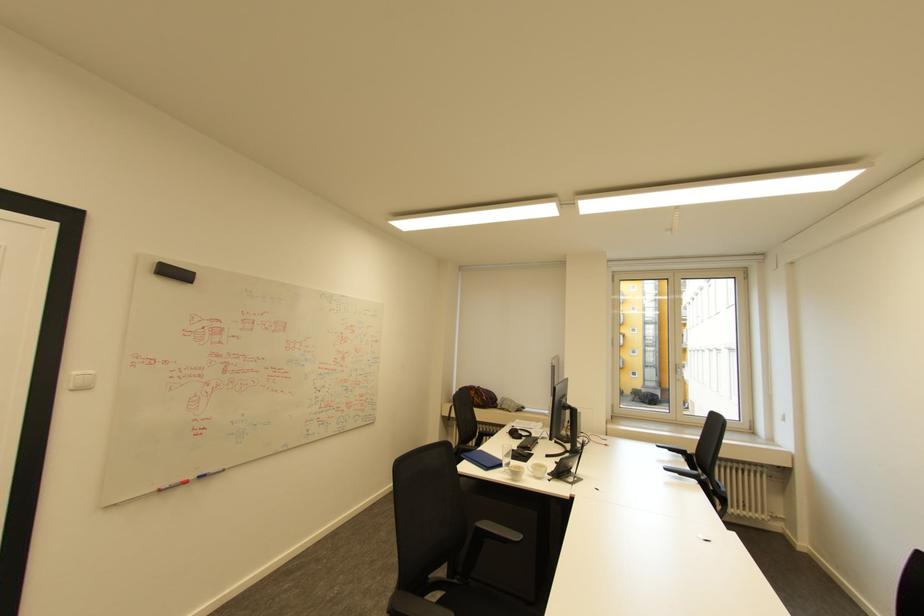
Image resolution: width=924 pixels, height=616 pixels. Describe the element at coordinates (479, 600) in the screenshot. I see `the chair sitting surface` at that location.